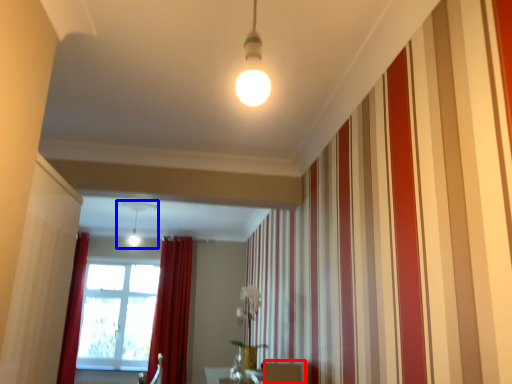
Question: Among these objects, which one is nearest to the camera, furniture (highlighted by a red box) or light fixture (highlighted by a blue box)?

Choices:
 (A) furniture
 (B) light fixture

Answer: (A)